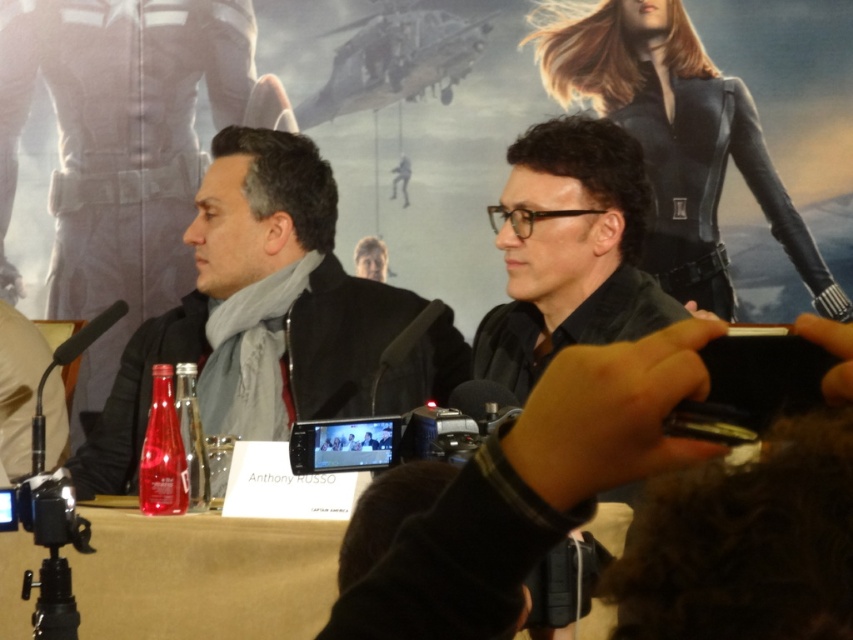
Question: Is black matte scarf at left to the right of black matte microphone at left from the viewer's perspective?

Choices:
 (A) no
 (B) yes

Answer: (B)

Question: Which of the following is the closest to the observer?

Choices:
 (A) black matte microphone at left
 (B) black matte scarf at left

Answer: (A)

Question: Is black matte scarf at left to the left of black matte microphone at left from the viewer's perspective?

Choices:
 (A) yes
 (B) no

Answer: (B)

Question: Can you confirm if black matte scarf at left is positioned above black matte microphone at left?

Choices:
 (A) no
 (B) yes

Answer: (A)